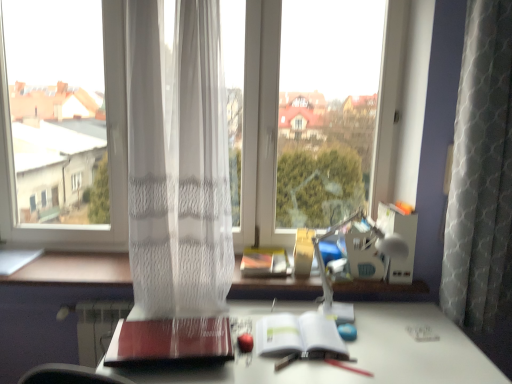
Question: From the image's perspective, relative to transparent fabric at center, is white sheer curtain at center above or below?

Choices:
 (A) above
 (B) below

Answer: (B)

Question: Is white sheer curtain at center spatially inside transparent fabric at center, or outside of it?

Choices:
 (A) outside
 (B) inside

Answer: (A)

Question: Considering the real-world distances, which object is farthest from the white matte computer desk at center?

Choices:
 (A) transparent fabric at center
 (B) white glossy desk at center
 (C) white sheer curtain at center
 (D) matte red notebook at center, positioned as the second paperback book in right-to-left order
 (E) white paper at center, which is counted as the 1th paperback book, starting from the right

Answer: (B)

Question: Which is nearer to the white sheer curtain at center?

Choices:
 (A) transparent fabric at center
 (B) white paper at center, which is counted as the 1th paperback book, starting from the right
 (C) white glossy desk at center
 (D) white matte computer desk at center
 (E) matte red notebook at center, the 1th paperback book viewed from the left

Answer: (A)